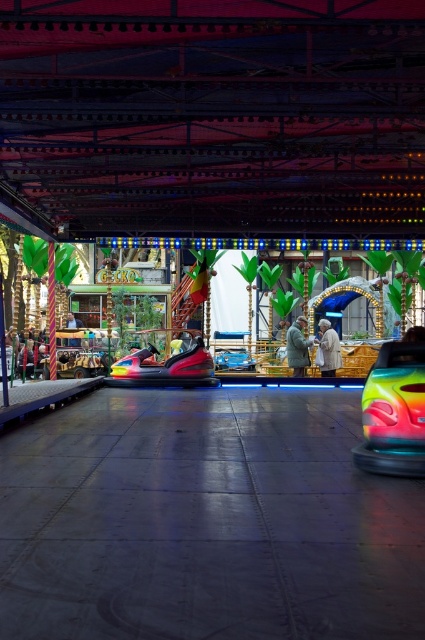
Can you confirm if rainbow glossy bumper car at center is positioned to the left of rainbow plastic bumper car at center?

Incorrect, rainbow glossy bumper car at center is not on the left side of rainbow plastic bumper car at center.

Does rainbow glossy bumper car at center have a lesser width compared to rainbow plastic bumper car at center?

Correct, rainbow glossy bumper car at center's width is less than rainbow plastic bumper car at center's.

Between point (399, 417) and point (155, 364), which one is positioned behind?

Point (155, 364)

What are the coordinates of `rainbow glossy bumper car at center` in the screenshot? It's located at (394, 410).

How distant is light brown fabric coat at center from light brown leather jacket at center?

The distance of light brown fabric coat at center from light brown leather jacket at center is 15.11 meters.

Does light brown fabric coat at center have a smaller size compared to light brown leather jacket at center?

Correct, light brown fabric coat at center occupies less space than light brown leather jacket at center.

From the picture: Who is more forward, (x=305, y=371) or (x=79, y=339)?

Positioned in front is point (x=305, y=371).

Locate an element on the screen. light brown fabric coat at center is located at coordinates (297, 348).

Can you confirm if white fabric coat at center is taller than light brown leather jacket at center?

Yes.

Measure the distance from white fabric coat at center to light brown leather jacket at center.

white fabric coat at center is 43.58 feet from light brown leather jacket at center.

Who is more distant from viewer, (336, 339) or (74, 323)?

The point (74, 323) is behind.

In order to click on white fabric coat at center in this screenshot , I will do `click(328, 349)`.